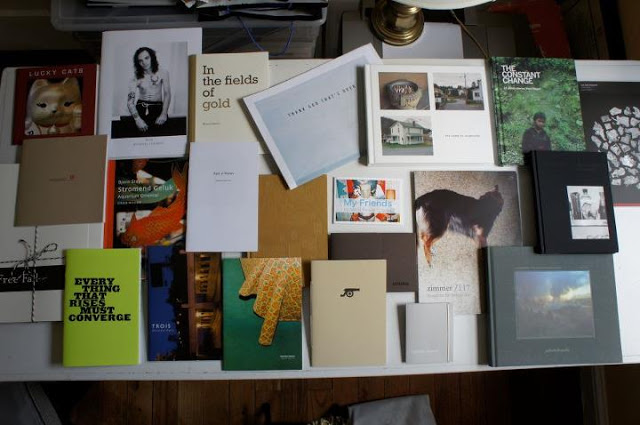
Locate an element on the screen. The height and width of the screenshot is (425, 640). towel is located at coordinates (381, 395).